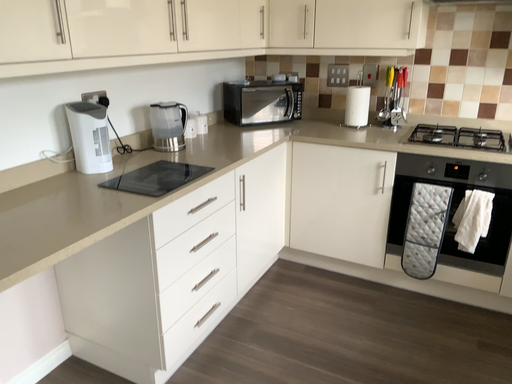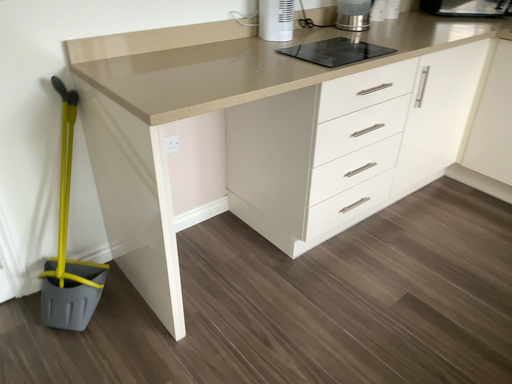
Question: Which way did the camera rotate in the video?

Choices:
 (A) rotated right
 (B) rotated left

Answer: (B)